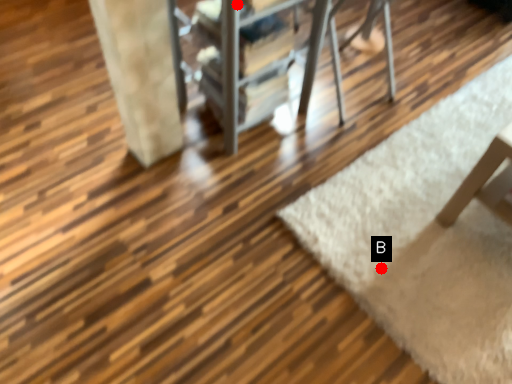
Question: Two points are circled on the image, labeled by A and B beside each circle. Which point is closer to the camera?

Choices:
 (A) A is closer
 (B) B is closer

Answer: (A)